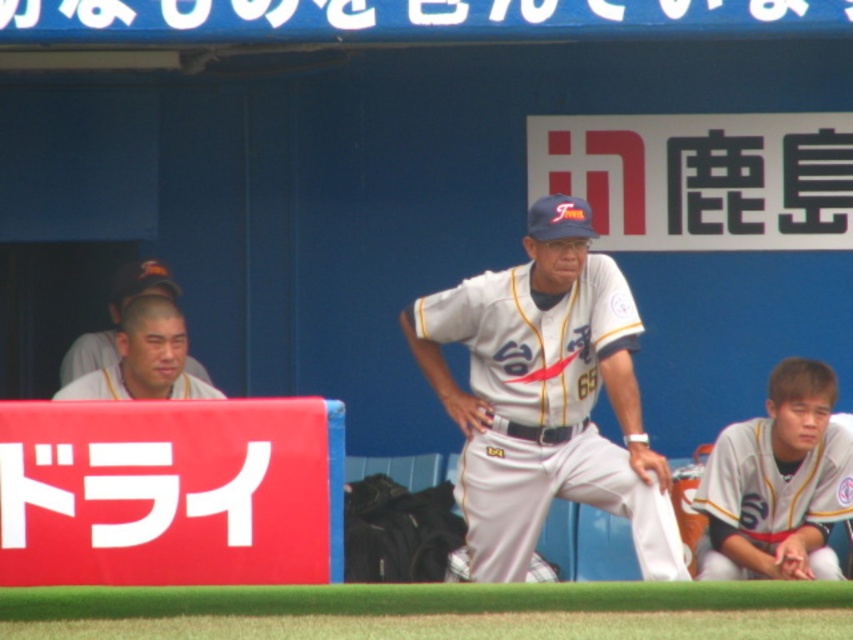
Is white uniform at lower right taller than white fabric baseball uniform at left?

Yes, white uniform at lower right is taller than white fabric baseball uniform at left.

Is point (788, 392) in front of point (184, 387)?

Yes.

What are the coordinates of `white uniform at lower right` in the screenshot? It's located at (778, 483).

Can you confirm if white fabric uniform at center is smaller than white uniform at lower right?

No, white fabric uniform at center is not smaller than white uniform at lower right.

Where is `white fabric uniform at center`? white fabric uniform at center is located at coordinates [544, 396].

Describe the element at coordinates (544, 396) in the screenshot. I see `white fabric uniform at center` at that location.

Identify the location of white fabric uniform at center. (544, 396).

Is point (74, 342) behind point (132, 392)?

Yes, point (74, 342) is behind point (132, 392).

Which of these two, matte gray cap at left or white fabric baseball uniform at left, stands taller?

Standing taller between the two is matte gray cap at left.

Describe the element at coordinates (115, 316) in the screenshot. I see `matte gray cap at left` at that location.

This screenshot has height=640, width=853. I want to click on matte gray cap at left, so click(115, 316).